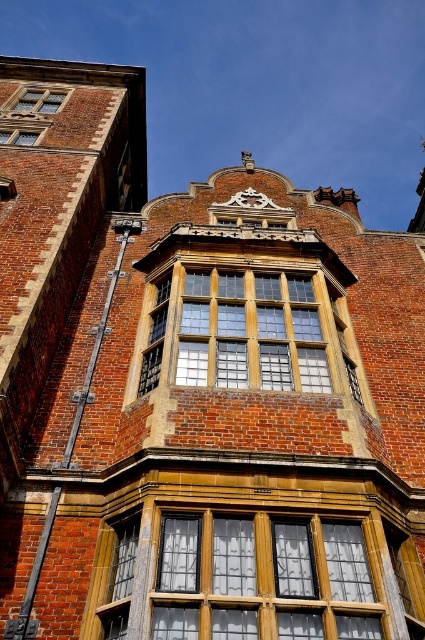
You are standing in front of the historic brick building and want to locate the clear glass window at upper left. According to the coordinates provided, where exactly is it positioned?

The clear glass window at upper left is located at point coordinates (39, 100).

You are an architect inspecting the building. You notice a point marked at coordinates [39,100]. Based on the scene description, what does this point most likely represent?

The point at [39,100] most likely represents the clear glass window at upper left, as the Objects Description states that this coordinate indicates that specific feature.

You are an architect inspecting this historic building. You need to determine which window is nearer to you when standing at the base of the building. Which one is closer? The wooden textured window at center or the matte glass window at upper left?

The wooden textured window at center is closer to the viewer than the matte glass window at upper left.